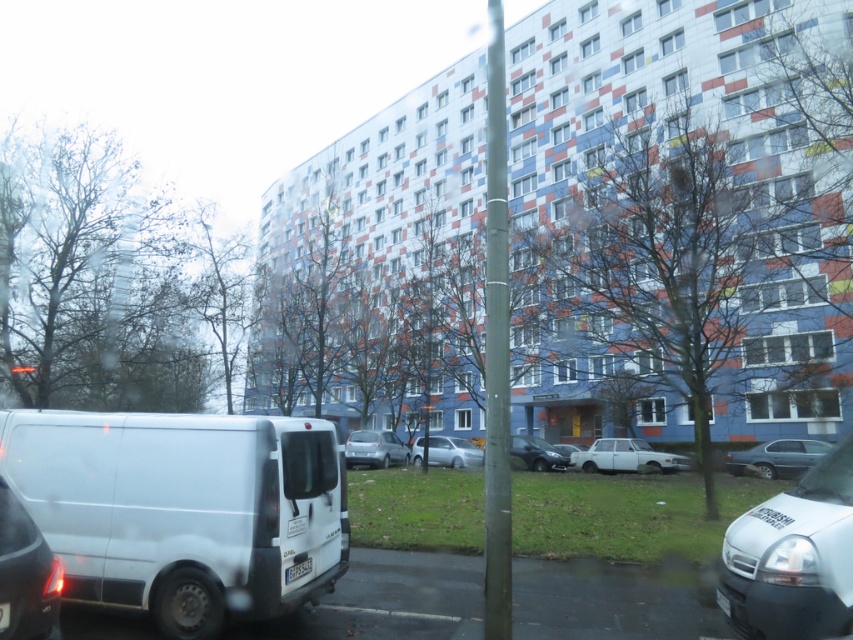
Is white matte van at left thinner than white plastic license plate at lower center?

In fact, white matte van at left might be wider than white plastic license plate at lower center.

Which is behind, point (202, 492) or point (305, 564)?

The point (305, 564) is more distant.

At what (x,y) coordinates should I click in order to perform the action: click on white matte van at left. Please return your answer as a coordinate pair (x, y). This screenshot has width=853, height=640. Looking at the image, I should click on (183, 509).

Consider the image. Who is lower down, silver metallic car at center or white plastic license plate at lower center?

silver metallic car at center is below.

Locate an element on the screen. The width and height of the screenshot is (853, 640). silver metallic car at center is located at coordinates (453, 452).

Is point (434, 449) positioned in front of point (303, 566)?

That is False.

This screenshot has height=640, width=853. What are the coordinates of `silver metallic car at center` in the screenshot? It's located at (453, 452).

Is point (22, 620) positioned behind point (376, 440)?

No, it is in front of (376, 440).

Measure the distance between matte white van at lower left and camera.

3.55 meters

Where is `matte white van at lower left`? matte white van at lower left is located at coordinates (26, 573).